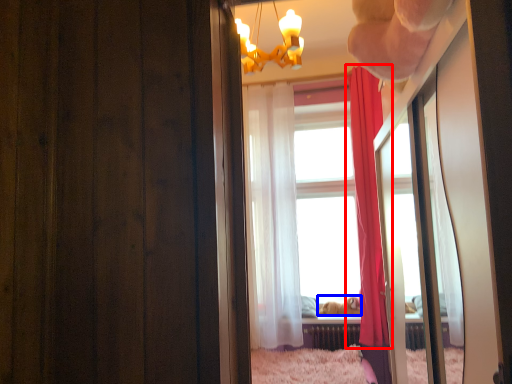
Question: Which object is further to the camera taking this photo, curtain (highlighted by a red box) or animal (highlighted by a blue box)?

Choices:
 (A) curtain
 (B) animal

Answer: (B)